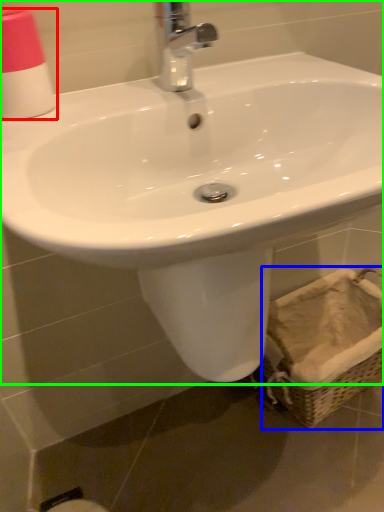
Question: Which object is the closest to the toiletry (highlighted by a red box)? Choose among these: basket (highlighted by a blue box) or sink (highlighted by a green box).

Choices:
 (A) basket
 (B) sink

Answer: (B)